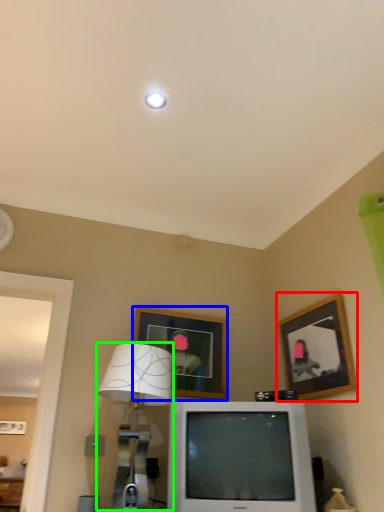
Question: Which is farther away from picture frame (highlighted by a red box)? picture frame (highlighted by a blue box) or table lamp (highlighted by a green box)?

Choices:
 (A) picture frame
 (B) table lamp

Answer: (B)